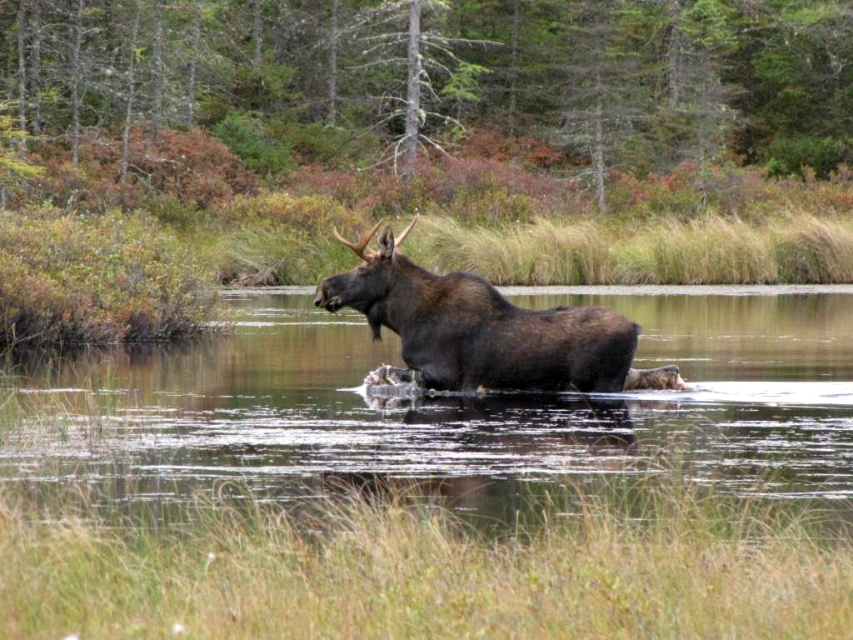
Can you confirm if brown water at center is bigger than brown furry moose at center?

Indeed, brown water at center has a larger size compared to brown furry moose at center.

Does brown water at center appear on the left side of brown furry moose at center?

Correct, you'll find brown water at center to the left of brown furry moose at center.

I want to click on brown water at center, so click(x=450, y=416).